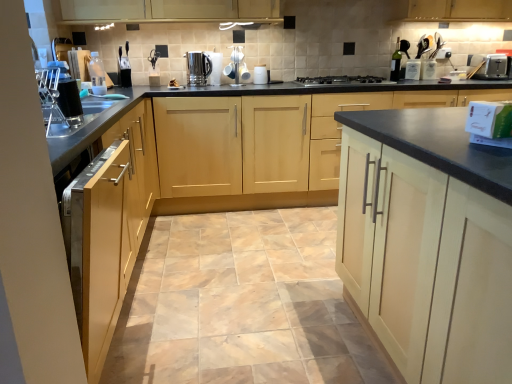
Question: Considering the positions of metallic silver toaster at upper right, positioned as the first appliance in back-to-front order, and light wood cabinet at right, the first cabinetry viewed from the right, in the image, is metallic silver toaster at upper right, positioned as the first appliance in back-to-front order, bigger or smaller than light wood cabinet at right, the first cabinetry viewed from the right,?

Choices:
 (A) small
 (B) big

Answer: (A)

Question: Is metallic silver toaster at upper right, the 2th appliance viewed from the front, wider or thinner than light wood cabinet at right, the first cabinetry viewed from the right?

Choices:
 (A) wide
 (B) thin

Answer: (B)

Question: Which object is positioned closest to the light wood cabinet at right, which is the third cabinetry in left-to-right order?

Choices:
 (A) satin silver kettle at center
 (B) natural stone floor at center
 (C) metallic silver toaster at upper right, arranged as the 2th appliance when viewed from the left
 (D) light wood cabinet at center, which is the 2th cabinetry from right to left
 (E) matte wood cabinet at left, which is counted as the third cabinetry, starting from the right

Answer: (B)

Question: Estimate the real-world distances between objects in this image. Which object is farther from the light wood cabinet at right, which is the third cabinetry in left-to-right order?

Choices:
 (A) satin silver kettle at center
 (B) light wood cabinet at center, placed as the second cabinetry when sorted from left to right
 (C) black matte gas stove at center
 (D) satin silver toaster at upper right
 (E) natural stone floor at center

Answer: (D)